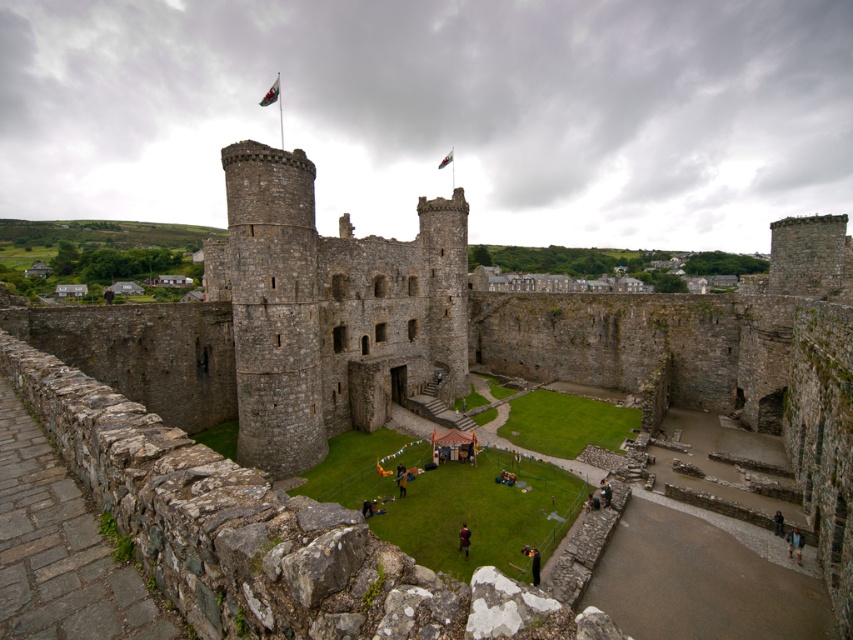
Is point (267, 104) in front of point (462, 531)?

No.

Does green fabric flag at upper center have a greater width compared to dark brown leather jacket at center?

Yes, green fabric flag at upper center is wider than dark brown leather jacket at center.

Is point (277, 93) less distant than point (465, 552)?

That is False.

The height and width of the screenshot is (640, 853). I want to click on green fabric flag at upper center, so click(x=271, y=93).

Is point (798, 556) closer to camera compared to point (451, 157)?

Yes, point (798, 556) is closer to viewer.

Locate an element on the screen. The image size is (853, 640). light brown leather jacket at lower right is located at coordinates (793, 541).

This screenshot has height=640, width=853. Find the location of `light brown leather jacket at lower right`. light brown leather jacket at lower right is located at coordinates (793, 541).

Which is in front, point (465, 540) or point (440, 161)?

Positioned in front is point (465, 540).

Does dark brown leather jacket at center have a larger size compared to green fabric flag at center?

Incorrect, dark brown leather jacket at center is not larger than green fabric flag at center.

Which is behind, point (459, 544) or point (445, 164)?

The point (445, 164) is more distant.

Find the location of a particular element. The height and width of the screenshot is (640, 853). dark brown leather jacket at center is located at coordinates (463, 540).